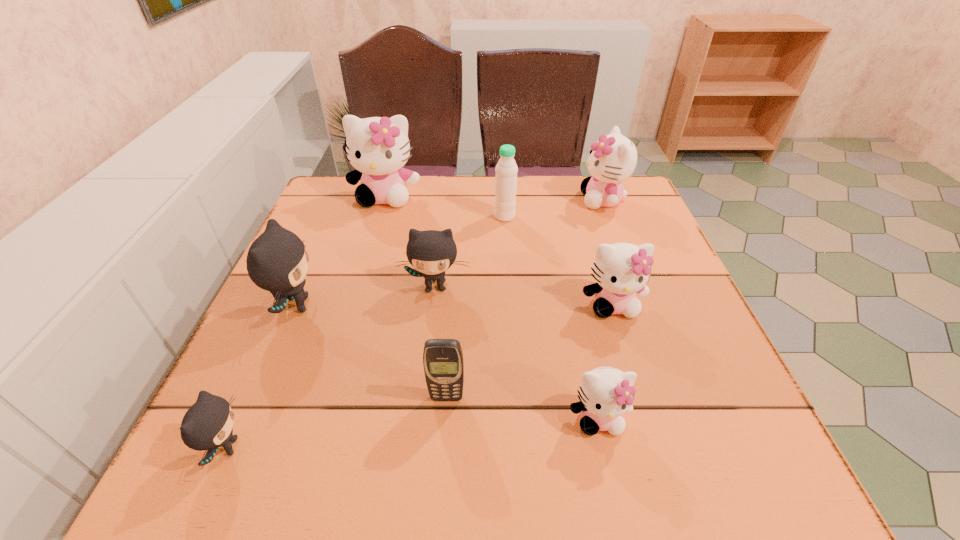
In the image, there is a desktop. In order to click on vacant space at the near right corner in this screenshot , I will do `click(753, 455)`.

Locate an element on the screen. free spot between the smallest white kitten and the rightmost gray kitten is located at coordinates (516, 353).

What are the coordinates of `empty space that is in between the water bottle and the biggest white kitten` in the screenshot? It's located at (445, 206).

At what (x,y) coordinates should I click in order to perform the action: click on vacant space that's between the white water bottle and the second biggest gray kitten. Please return your answer as a coordinate pair (x, y). The height and width of the screenshot is (540, 960). Looking at the image, I should click on (469, 252).

Where is `free space between the rightmost gray kitten and the white water bottle`? free space between the rightmost gray kitten and the white water bottle is located at coordinates (469, 252).

At what (x,y) coordinates should I click in order to perform the action: click on vacant area that lies between the leftmost white kitten and the second biggest white kitten. Please return your answer as a coordinate pair (x, y). Looking at the image, I should click on 494,198.

Locate an element on the screen. Image resolution: width=960 pixels, height=540 pixels. free space between the second biggest white kitten and the white water bottle is located at coordinates (554, 208).

Find the location of a particular element. This screenshot has width=960, height=540. empty location between the cellular telephone and the nearest gray kitten is located at coordinates (337, 423).

Where is `vacant space that's between the white water bottle and the biggest gray kitten`? This screenshot has height=540, width=960. vacant space that's between the white water bottle and the biggest gray kitten is located at coordinates (400, 261).

Point out which object is positioned as the sixth nearest to the rightmost gray kitten. Please provide its 2D coordinates. Your answer should be formatted as a tuple, i.e. [(x, y)], where the tuple contains the x and y coordinates of a point satisfying the conditions above.

[(606, 393)]